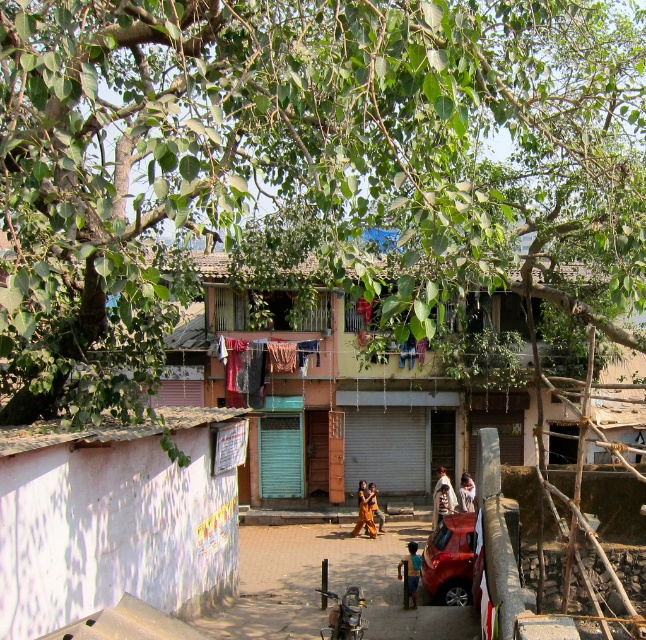
Question: Which is nearer to the brown leather jacket at center?

Choices:
 (A) dark blue fabric at center
 (B) light brown wooden hut at center

Answer: (A)

Question: Which object is farther from the camera taking this photo?

Choices:
 (A) brown fabric dress at center
 (B) orange fabric at center
 (C) brown leather jacket at center

Answer: (B)

Question: Considering the relative positions of brown fabric dress at center and brown leather jacket at center in the image provided, where is brown fabric dress at center located with respect to brown leather jacket at center?

Choices:
 (A) right
 (B) left

Answer: (B)

Question: Which object is the farthest from the green leafy tree at upper center?

Choices:
 (A) brown fabric cloth at center
 (B) metallic silver motorcycle at lower center

Answer: (A)

Question: Can you confirm if multicolored fabric at center is smaller than brown fabric cloth at center?

Choices:
 (A) yes
 (B) no

Answer: (B)

Question: Can you confirm if light brown wooden hut at center is positioned to the right of metallic silver motorcycle at lower center?

Choices:
 (A) no
 (B) yes

Answer: (B)